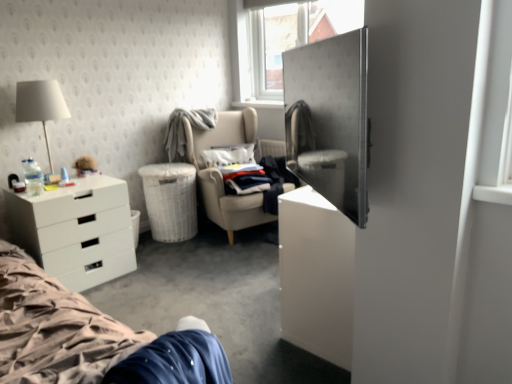
Question: Does beige fabric chair at center lie behind metallic silver armoire at right?

Choices:
 (A) no
 (B) yes

Answer: (B)

Question: From a real-world perspective, is beige fabric chair at center under metallic silver armoire at right?

Choices:
 (A) yes
 (B) no

Answer: (A)

Question: From a real-world perspective, is beige fabric chair at center on metallic silver armoire at right?

Choices:
 (A) yes
 (B) no

Answer: (B)

Question: Is beige fabric chair at center wider than metallic silver armoire at right?

Choices:
 (A) no
 (B) yes

Answer: (B)

Question: Does beige fabric chair at center turn towards metallic silver armoire at right?

Choices:
 (A) yes
 (B) no

Answer: (A)

Question: Are beige fabric chair at center and metallic silver armoire at right beside each other?

Choices:
 (A) yes
 (B) no

Answer: (B)

Question: Is white woven trash bin/can at lower left closer to camera compared to beige fabric chair at center?

Choices:
 (A) yes
 (B) no

Answer: (B)

Question: Is white woven trash bin/can at lower left not near beige fabric chair at center?

Choices:
 (A) no
 (B) yes

Answer: (A)

Question: Can you confirm if white woven trash bin/can at lower left is wider than beige fabric chair at center?

Choices:
 (A) no
 (B) yes

Answer: (A)

Question: Is white woven trash bin/can at lower left to the right of beige fabric chair at center from the viewer's perspective?

Choices:
 (A) no
 (B) yes

Answer: (A)

Question: Would you say white woven trash bin/can at lower left contains beige fabric chair at center?

Choices:
 (A) yes
 (B) no

Answer: (B)

Question: Is white woven trash bin/can at lower left completely or partially outside of beige fabric chair at center?

Choices:
 (A) no
 (B) yes

Answer: (B)

Question: Is white matte drawer at lower left turned away from white matte lampshade at upper left?

Choices:
 (A) yes
 (B) no

Answer: (B)